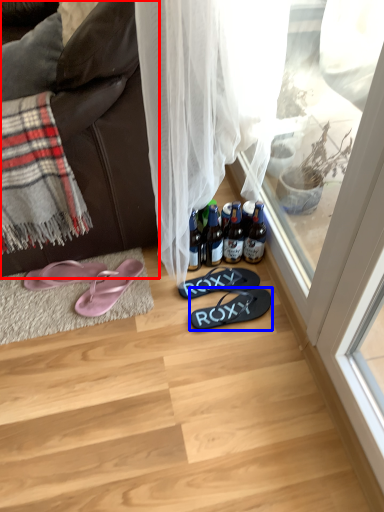
Question: Among these objects, which one is farthest to the camera, studio couch (highlighted by a red box) or footwear (highlighted by a blue box)?

Choices:
 (A) studio couch
 (B) footwear

Answer: (B)